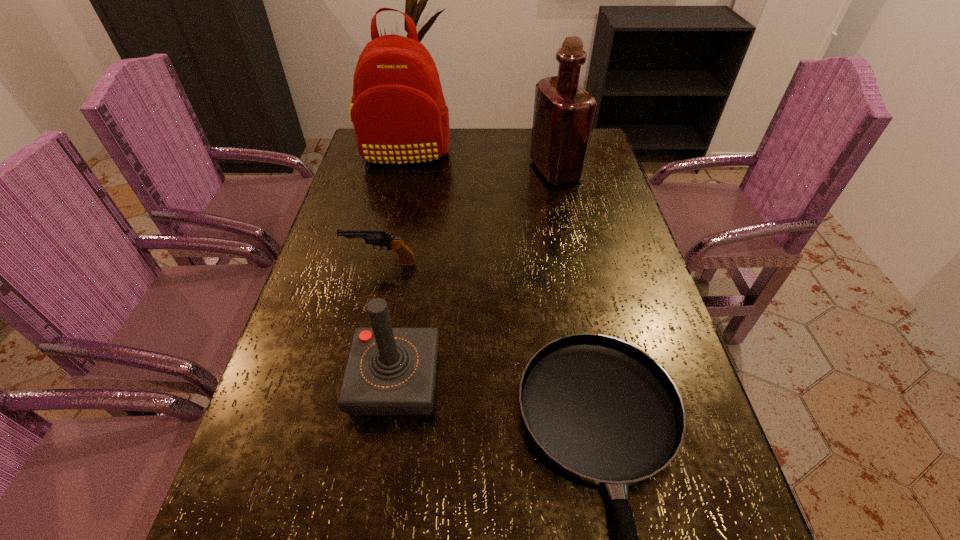
This screenshot has width=960, height=540. Identify the location of liquor located at the far edge. (564, 113).

Where is `backpack present at the left edge`? The image size is (960, 540). backpack present at the left edge is located at coordinates (399, 114).

Where is `joystick present at the left edge`? The image size is (960, 540). joystick present at the left edge is located at coordinates (390, 371).

You are a GUI agent. You are given a task and a screenshot of the screen. Output one action in this format:
    pyautogui.click(x=<x>, y=<y>)
    Task: Click on the gun at the left edge
    The height and width of the screenshot is (540, 960).
    Given the screenshot: What is the action you would take?
    pyautogui.click(x=380, y=238)

This screenshot has width=960, height=540. Identify the location of object positioned at the right edge. (564, 113).

This screenshot has width=960, height=540. I want to click on object at the far left corner, so click(399, 114).

Where is `object situated at the far right corner`? This screenshot has height=540, width=960. object situated at the far right corner is located at coordinates (564, 113).

Where is `vacant space at the left edge`? This screenshot has height=540, width=960. vacant space at the left edge is located at coordinates (353, 195).

In the image, there is a desktop. Where is `free space at the right edge`? free space at the right edge is located at coordinates (698, 456).

Identify the location of free space that is in between the second shortest object and the backpack. This screenshot has height=540, width=960. pyautogui.click(x=393, y=208).